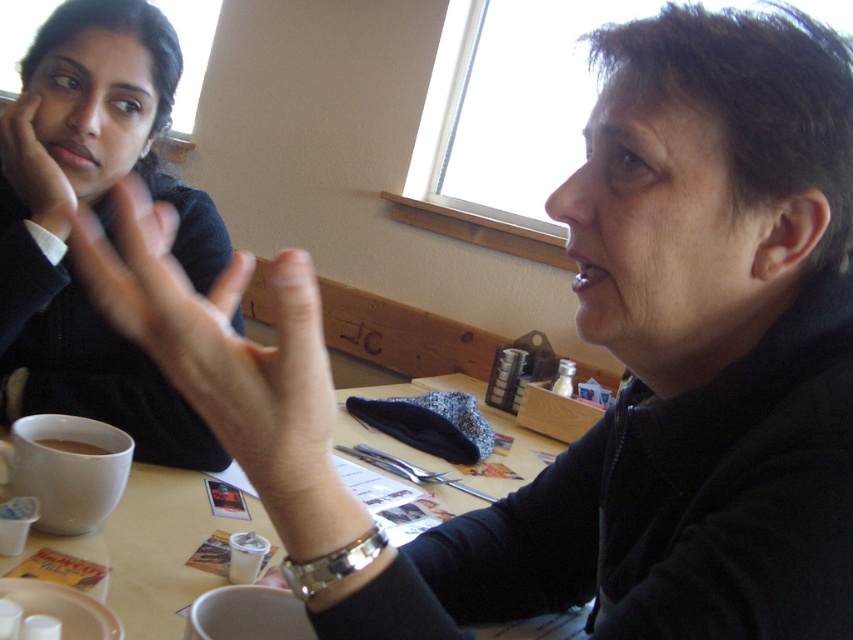
Question: Which object appears farthest from the camera in this image?

Choices:
 (A) skinny white hand at center
 (B) matte plastic table at center
 (C) matte black hand at upper left
 (D) matte white cup at lower left

Answer: (B)

Question: Which of the following is the farthest from the observer?

Choices:
 (A) matte black sweater at upper left
 (B) matte black hand at upper left
 (C) white matte mug at lower left
 (D) matte plastic table at center

Answer: (D)

Question: Is matte black sweater at upper left wider than matte black hand at upper left?

Choices:
 (A) no
 (B) yes

Answer: (B)

Question: Does skinny white hand at center appear on the right side of matte plastic table at center?

Choices:
 (A) no
 (B) yes

Answer: (A)

Question: Which point appears closest to the camera in this image?

Choices:
 (A) (99, 436)
 (B) (534, 435)
 (C) (49, 166)

Answer: (A)

Question: Observing the image, what is the correct spatial positioning of matte plastic table at center in reference to matte white cup at lower left?

Choices:
 (A) above
 (B) below

Answer: (B)